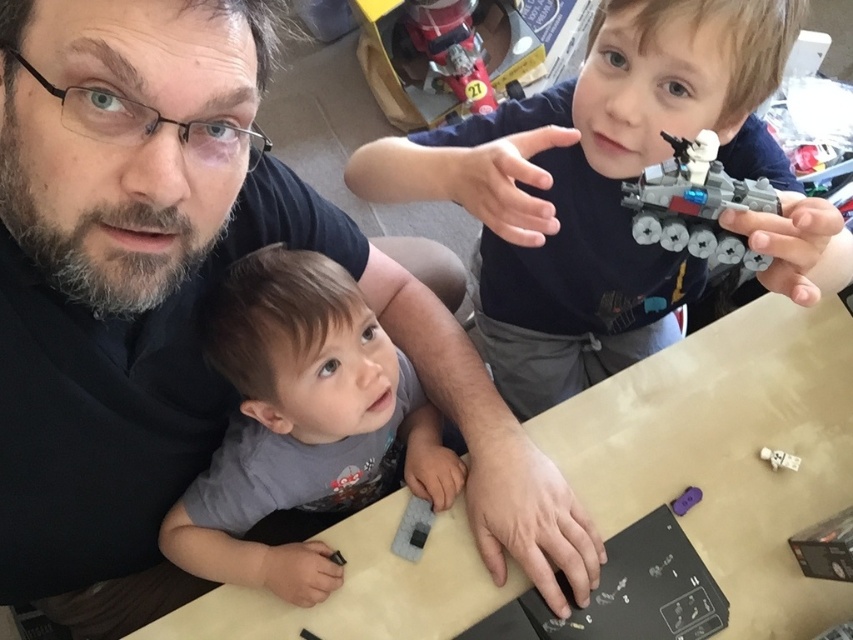
Question: Among these points, which one is nearest to the camera?

Choices:
 (A) (410, 500)
 (B) (480, 67)
 (C) (712, 490)

Answer: (C)

Question: Which of the following is the farthest from the observer?

Choices:
 (A) gray plastic spaceship at upper right
 (B) white plastic toy at center

Answer: (B)

Question: Which of the following is the closest to the observer?

Choices:
 (A) (730, 186)
 (B) (511, 120)
 (C) (801, 598)
 (D) (265, 346)

Answer: (A)

Question: Does gray plastic spaceship at upper right appear on the right side of purple plastic toy at lower right?

Choices:
 (A) yes
 (B) no

Answer: (B)

Question: Observing the image, what is the correct spatial positioning of gray plastic toy at center in reference to white plastic toy at center?

Choices:
 (A) below
 (B) above

Answer: (A)

Question: Observing the image, what is the correct spatial positioning of gray matte shirt at lower left in reference to purple plastic toy at lower right?

Choices:
 (A) above
 (B) below

Answer: (A)